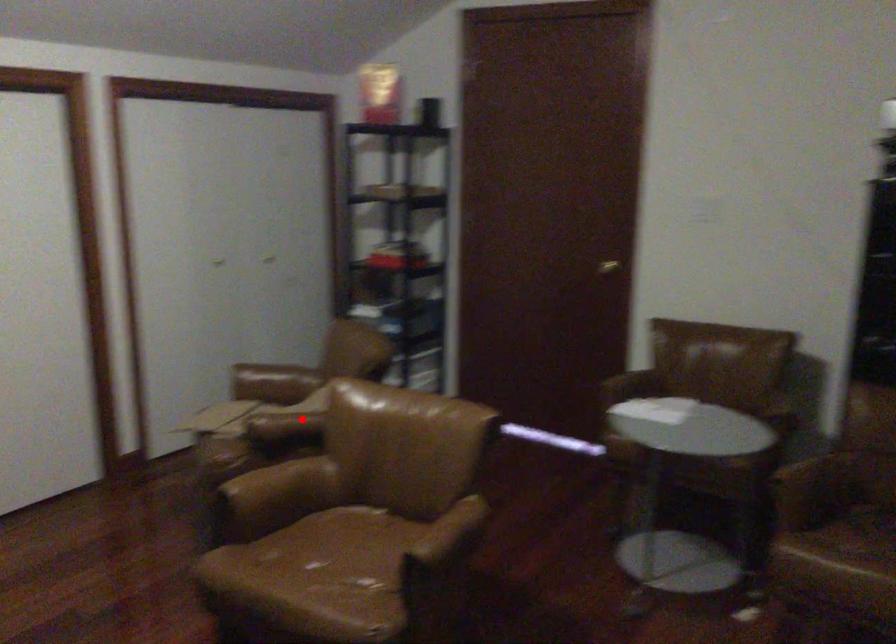
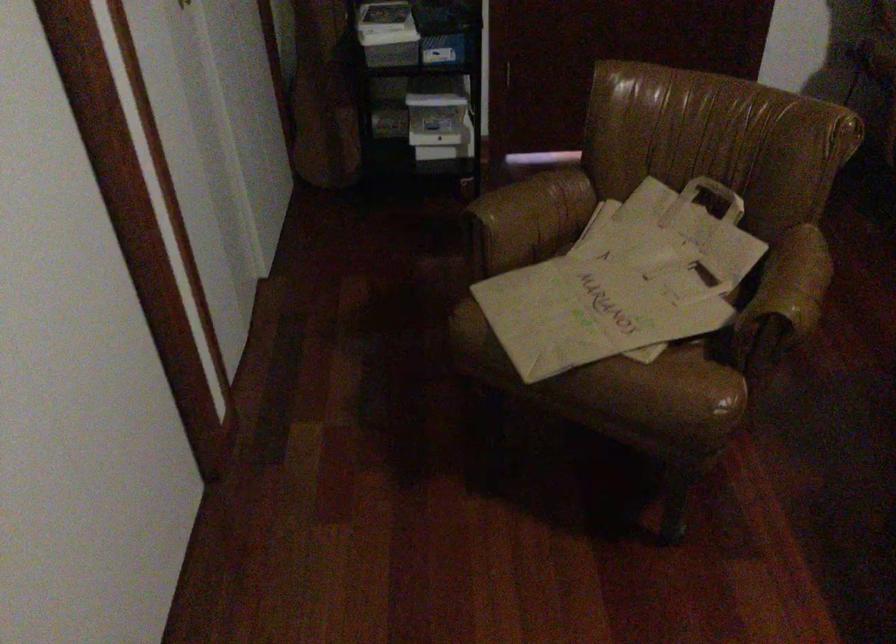
Question: I am providing you with two images of the same scene from different viewpoints. A red point is marked on the first image. At the location where the point appears in image 1, is it still visible in image 2?

Choices:
 (A) Yes
 (B) No

Answer: (A)